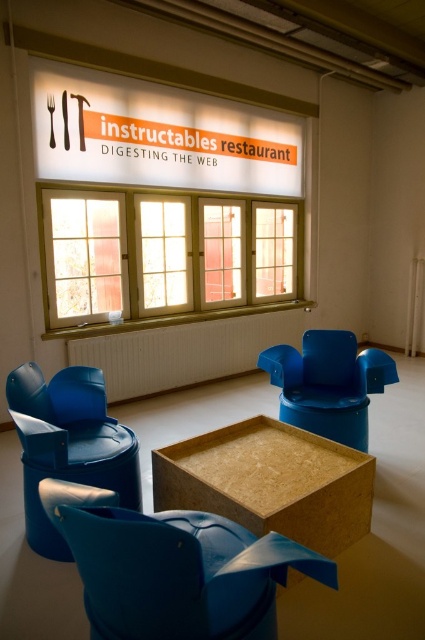
You are a guest at the Instructables Restaurant and need to choose seating. You prefer a taller seat. Which chair should you choose between the matte blue armchair at lower left and the blue plastic chair at center?

The matte blue armchair at lower left is taller than the blue plastic chair at center, so you should choose the matte blue armchair at lower left.

You are standing in the dining area and looking at the window. There are two points marked on the window. The first point is at coordinate point [113,244] and the second point is at coordinate point [257,237]. Which point is closer to you?

Point [113,244] is further to the camera than point [257,237], so the second point at [257,237] is closer to you.